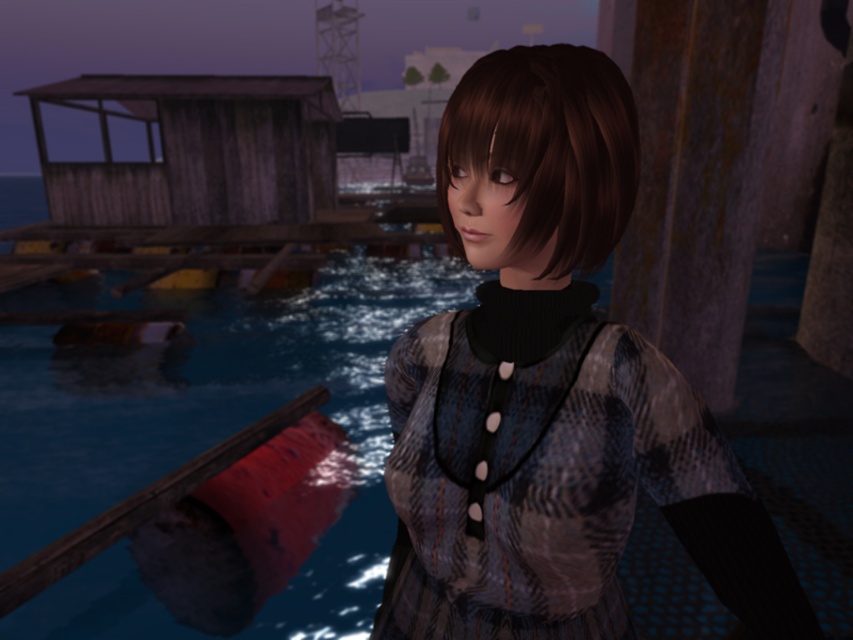
Question: Which point is farther from the camera taking this photo?

Choices:
 (A) (285, 410)
 (B) (535, 234)

Answer: (A)

Question: Can you confirm if striped fabric dress at center is bigger than wooden rail at lower left?

Choices:
 (A) yes
 (B) no

Answer: (B)

Question: Among these objects, which one is farthest from the camera?

Choices:
 (A) textured brown hair at center
 (B) striped fabric dress at center
 (C) wooden rail at lower left

Answer: (C)

Question: Can you confirm if textured brown hair at center is positioned to the right of striped fabric dress at center?

Choices:
 (A) no
 (B) yes

Answer: (B)

Question: Does textured brown hair at center appear over shiny brown hair at center?

Choices:
 (A) yes
 (B) no

Answer: (B)

Question: Which object is closer to the camera taking this photo?

Choices:
 (A) textured brown hair at center
 (B) striped fabric dress at center

Answer: (A)